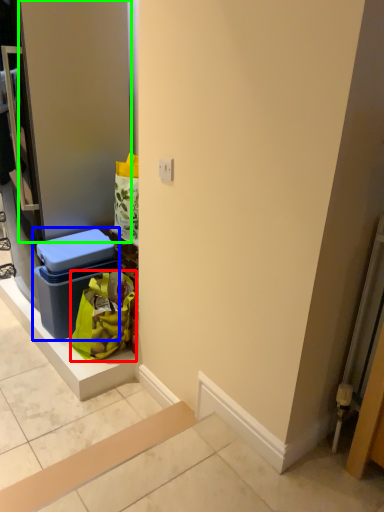
Question: Considering the real-world distances, which object is closest to shopping bag (highlighted by a red box)? storage box (highlighted by a blue box) or door (highlighted by a green box).

Choices:
 (A) storage box
 (B) door

Answer: (A)